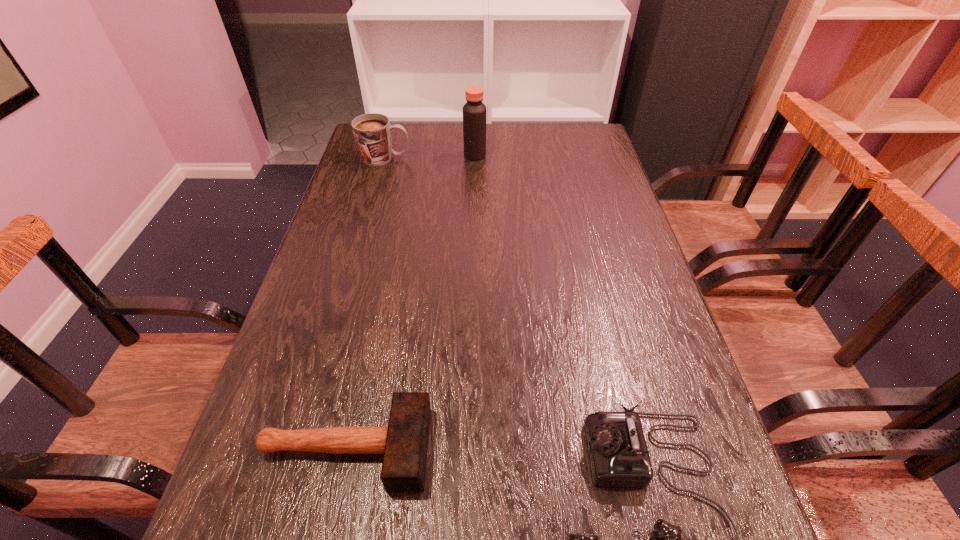
The width and height of the screenshot is (960, 540). In order to click on mallet located in the left edge section of the desktop in this screenshot , I will do `click(404, 443)`.

Image resolution: width=960 pixels, height=540 pixels. I want to click on object that is positioned at the far left corner, so click(x=372, y=132).

In the image, there is a desktop. Where is `vacant space at the far edge`? vacant space at the far edge is located at coordinates (502, 152).

The width and height of the screenshot is (960, 540). In order to click on free space at the left edge of the desktop in this screenshot , I will do `click(367, 262)`.

Find the location of a particular element. vacant space at the right edge is located at coordinates (628, 210).

Image resolution: width=960 pixels, height=540 pixels. Find the location of `vacant space at the far right corner of the desktop`. vacant space at the far right corner of the desktop is located at coordinates (570, 133).

The height and width of the screenshot is (540, 960). Identify the location of free space between the mallet and the third shortest object. (366, 303).

The width and height of the screenshot is (960, 540). I want to click on free spot between the mallet and the second tallest object, so click(x=366, y=303).

I want to click on free space between the vinegar and the mug, so pos(430,157).

Where is `free space between the shortest object and the mug`? free space between the shortest object and the mug is located at coordinates (366, 303).